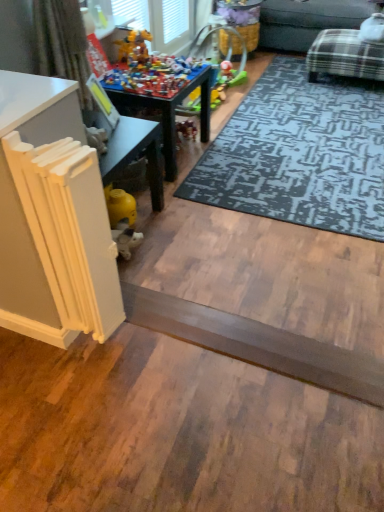
Describe the element at coordinates (300, 153) in the screenshot. Image resolution: width=384 pixels, height=512 pixels. I see `dark gray textured rug at center` at that location.

What do you see at coordinates (257, 344) in the screenshot?
I see `smooth gray plank at center` at bounding box center [257, 344].

I want to click on white painted wood table at lower left, marked as the 1th table in a front-to-back arrangement, so click(60, 215).

Identify the location of white fabric curtain at upper left. This screenshot has height=512, width=384. (62, 42).

From the image's perspective, is wooden toy table at center, which is the second table from front to back, located above plaid fabric couch at upper right?

No, from the image's perspective, wooden toy table at center, which is the second table from front to back, is not over plaid fabric couch at upper right.

Considering the relative positions of wooden toy table at center, arranged as the first table when viewed from the top, and plaid fabric couch at upper right in the image provided, is wooden toy table at center, arranged as the first table when viewed from the top, to the right of plaid fabric couch at upper right from the viewer's perspective?

No, wooden toy table at center, arranged as the first table when viewed from the top, is not to the right of plaid fabric couch at upper right.

Considering the sizes of objects wooden toy table at center, the first table from the back, and plaid fabric couch at upper right in the image provided, who is smaller, wooden toy table at center, the first table from the back, or plaid fabric couch at upper right?

Smaller between the two is wooden toy table at center, the first table from the back.

Between wooden toy table at center, which is the second table from front to back, and plaid fabric couch at upper right, which one has larger width?

plaid fabric couch at upper right is wider.

Is white fabric curtain at upper left at the right side of multicolored plastic toys at center?

No, white fabric curtain at upper left is not to the right of multicolored plastic toys at center.

Which is in front, white fabric curtain at upper left or multicolored plastic toys at center?

Positioned in front is white fabric curtain at upper left.

Which is behind, point (85, 89) or point (102, 79)?

Positioned behind is point (102, 79).

Is white fabric curtain at upper left oriented towards multicolored plastic toys at center?

No, white fabric curtain at upper left is not turned towards multicolored plastic toys at center.

From the picture: Is multicolored plastic toys at center outside of smooth gray plank at center?

Indeed, multicolored plastic toys at center is completely outside smooth gray plank at center.

In the scene shown: Is multicolored plastic toys at center to the right of smooth gray plank at center from the viewer's perspective?

No, multicolored plastic toys at center is not to the right of smooth gray plank at center.

Find the location of `plank in front of the multicolored plastic toys at center`. plank in front of the multicolored plastic toys at center is located at coordinates (257, 344).

Are multicolored plastic toys at center and smooth gray plank at center located far from each other?

Yes, multicolored plastic toys at center and smooth gray plank at center are located far from each other.

From a real-world perspective, who is located lower, wooden toy table at center, arranged as the first table when viewed from the top, or multicolored plastic toys at center?

From a 3D spatial view, wooden toy table at center, arranged as the first table when viewed from the top, is below.

Does wooden toy table at center, arranged as the first table when viewed from the top, turn towards multicolored plastic toys at center?

No, wooden toy table at center, arranged as the first table when viewed from the top, is not oriented towards multicolored plastic toys at center.

Is wooden toy table at center, arranged as the second table when ordered from the bottom, bigger than multicolored plastic toys at center?

Yes, wooden toy table at center, arranged as the second table when ordered from the bottom, is bigger than multicolored plastic toys at center.

Which of these two, multicolored plastic toys at center or dark gray textured rug at center, is wider?

dark gray textured rug at center.

Which object is positioned more to the left, multicolored plastic toys at center or dark gray textured rug at center?

multicolored plastic toys at center.

Is smooth gray plank at center at the back of dark gray textured rug at center?

No, dark gray textured rug at center is not facing away from smooth gray plank at center.

Does dark gray textured rug at center have a greater width compared to smooth gray plank at center?

Indeed, dark gray textured rug at center has a greater width compared to smooth gray plank at center.

Locate an element on the screen. Image resolution: width=384 pixels, height=512 pixels. mat on the right side of smooth gray plank at center is located at coordinates (300, 153).

Based on the photo, does dark gray textured rug at center come in front of smooth gray plank at center?

No, it is behind smooth gray plank at center.

From a real-world perspective, is multicolored plastic toys at center physically located above or below white fabric curtain at upper left?

From a real-world perspective, multicolored plastic toys at center is physically below white fabric curtain at upper left.

Is multicolored plastic toys at center at the left side of white fabric curtain at upper left?

No.

Can you confirm if multicolored plastic toys at center is shorter than white fabric curtain at upper left?

Yes, multicolored plastic toys at center is shorter than white fabric curtain at upper left.

Where is `the 1st table below when counting from the plaid fabric couch at upper right (from the image's perspective)`? the 1st table below when counting from the plaid fabric couch at upper right (from the image's perspective) is located at coordinates (171, 113).

The width and height of the screenshot is (384, 512). In order to click on curtain in front of the multicolored plastic toys at center in this screenshot , I will do `click(62, 42)`.

From the image, which object appears to be farther from smooth gray plank at center, white fabric curtain at upper left or plaid fabric couch at upper right?

plaid fabric couch at upper right is further to smooth gray plank at center.

Considering their positions, is white fabric curtain at upper left positioned further to smooth gray plank at center than dark gray textured rug at center?

dark gray textured rug at center.

Estimate the real-world distances between objects in this image. Which object is further from multicolored plastic toys at center, white painted wood table at lower left, marked as the 1th table in a front-to-back arrangement, or smooth gray plank at center?

Based on the image, smooth gray plank at center appears to be further to multicolored plastic toys at center.

In the scene shown: When comparing their distances from plaid fabric couch at upper right, does wooden toy table at center, arranged as the first table when viewed from the top, or multicolored plastic toys at center seem closer?

wooden toy table at center, arranged as the first table when viewed from the top, is positioned closer to the anchor plaid fabric couch at upper right.

Which object lies nearer to the anchor point white painted wood table at lower left, arranged as the first table when ordered from the bottom, wooden toy table at center, arranged as the first table when viewed from the top, or multicolored plastic toys at center?

multicolored plastic toys at center lies closer to white painted wood table at lower left, arranged as the first table when ordered from the bottom, than the other object.

Which object lies nearer to the anchor point white fabric curtain at upper left, white painted wood table at lower left, arranged as the first table when ordered from the bottom, or dark gray textured rug at center?

white painted wood table at lower left, arranged as the first table when ordered from the bottom.

When comparing their distances from smooth gray plank at center, does multicolored plastic toys at center or white painted wood table at lower left, marked as the 1th table in a front-to-back arrangement, seem closer?

white painted wood table at lower left, marked as the 1th table in a front-to-back arrangement, is positioned closer to the anchor smooth gray plank at center.

Considering their positions, is dark gray textured rug at center positioned further to wooden toy table at center, which is the second table from front to back, than white fabric curtain at upper left?

dark gray textured rug at center.

Identify the location of table between plaid fabric couch at upper right and white painted wood table at lower left, which ranks as the 2th table in top-to-bottom order, in the vertical direction. (171, 113).

Identify the location of table between wooden toy table at center, which is the second table from front to back, and smooth gray plank at center in the up-down direction. This screenshot has width=384, height=512. (60, 215).

At what (x,y) coordinates should I click in order to perform the action: click on toy between white fabric curtain at upper left and dark gray textured rug at center. Please return your answer as a coordinate pair (x, y). The height and width of the screenshot is (512, 384). Looking at the image, I should click on (152, 71).

Locate an element on the screen. curtain between plaid fabric couch at upper right and smooth gray plank at center from top to bottom is located at coordinates (62, 42).